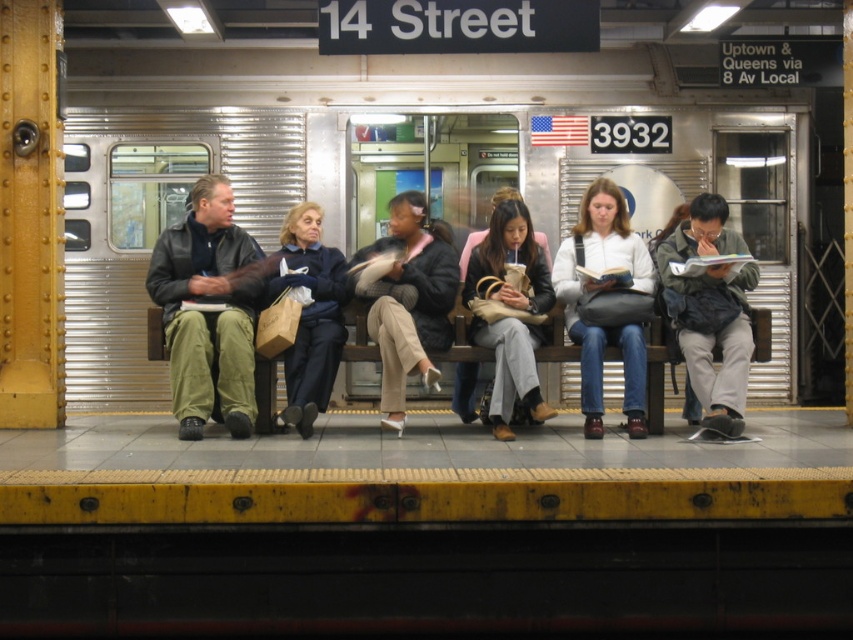
Is dark gray backpack at center positioned in front of wooden bench at center?

Yes, dark gray backpack at center is closer to the viewer.

Is point (701, 364) closer to viewer compared to point (363, 323)?

That is True.

Locate an element on the screen. Image resolution: width=853 pixels, height=640 pixels. dark gray backpack at center is located at coordinates (711, 310).

Is dark gray backpack at center positioned at the back of matte black jacket at center?

That is False.

Can you confirm if dark gray backpack at center is smaller than matte black jacket at center?

Yes, dark gray backpack at center is smaller than matte black jacket at center.

Identify the location of dark gray backpack at center. The image size is (853, 640). (711, 310).

Is silver metallic train at center to the left of white matte jacket at center from the viewer's perspective?

Yes, silver metallic train at center is to the left of white matte jacket at center.

Where is `silver metallic train at center`? silver metallic train at center is located at coordinates (238, 216).